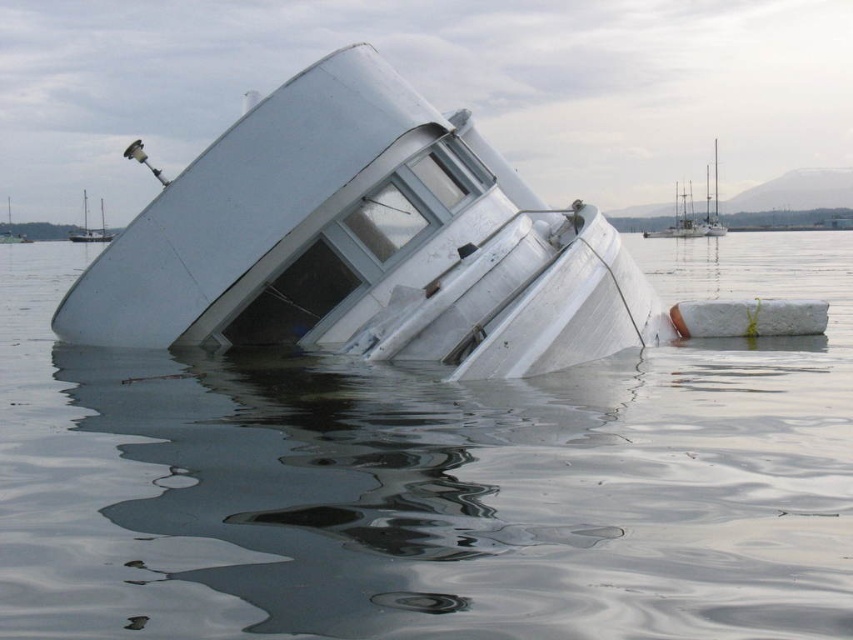
Between white matte boat at center and white glossy boat at center, which one has more height?

Standing taller between the two is white glossy boat at center.

Does point (375, 321) come behind point (9, 218)?

No, (375, 321) is closer to viewer.

The width and height of the screenshot is (853, 640). What are the coordinates of `white matte boat at center` in the screenshot? It's located at (364, 243).

Is point (64, 321) more distant than point (715, 157)?

That is False.

Is white matte boat at center wider than white matte boat at upper right?

In fact, white matte boat at center might be narrower than white matte boat at upper right.

What do you see at coordinates (364, 243) in the screenshot? I see `white matte boat at center` at bounding box center [364, 243].

The width and height of the screenshot is (853, 640). I want to click on white matte boat at center, so click(x=364, y=243).

Is transparent water at center wider than white matte boat at upper right?

Correct, the width of transparent water at center exceeds that of white matte boat at upper right.

Between transparent water at center and white matte boat at upper right, which one appears on the right side from the viewer's perspective?

From the viewer's perspective, white matte boat at upper right appears more on the right side.

The image size is (853, 640). What do you see at coordinates (434, 481) in the screenshot?
I see `transparent water at center` at bounding box center [434, 481].

Locate an element on the screen. The height and width of the screenshot is (640, 853). transparent water at center is located at coordinates (434, 481).